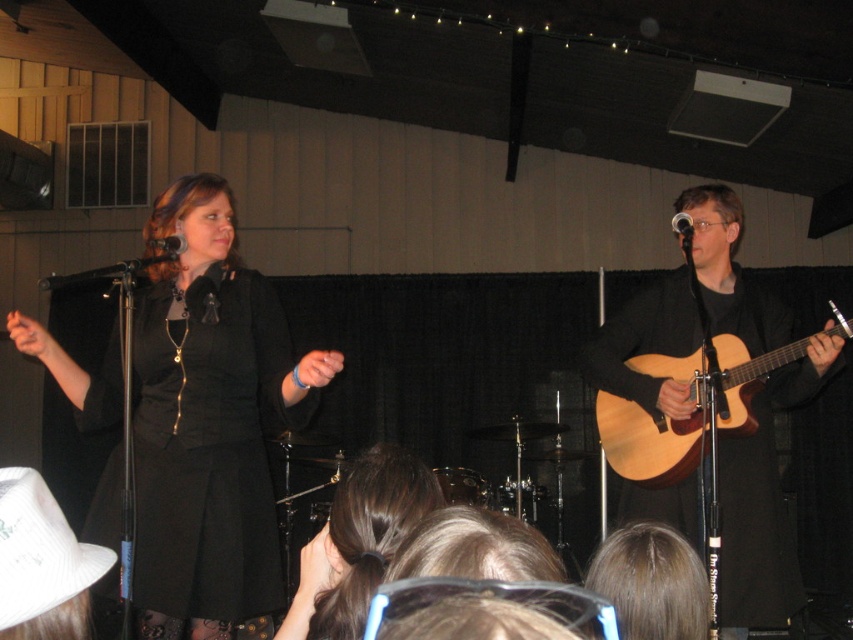
Question: Which is nearer to the light brown wood acoustic guitar at right?

Choices:
 (A) metallic silver microphone at upper center
 (B) white fabric cowboy hat at lower left

Answer: (A)

Question: Does black matte microphone at upper left appear under metallic silver microphone at upper center?

Choices:
 (A) yes
 (B) no

Answer: (A)

Question: Where is black matte microphone at upper left located in relation to metallic silver microphone at upper center in the image?

Choices:
 (A) right
 (B) left

Answer: (B)

Question: Does light brown wood acoustic guitar at right lie in front of metallic silver microphone at upper center?

Choices:
 (A) yes
 (B) no

Answer: (A)

Question: Which object is positioned closest to the metallic silver microphone at upper center?

Choices:
 (A) black matte dress at left
 (B) black matte microphone at upper left
 (C) light brown acoustic guitar at right

Answer: (C)

Question: Estimate the real-world distances between objects in this image. Which object is closer to the light brown acoustic guitar at right?

Choices:
 (A) light brown wood acoustic guitar at right
 (B) black matte microphone at upper left
 (C) black matte dress at left

Answer: (A)